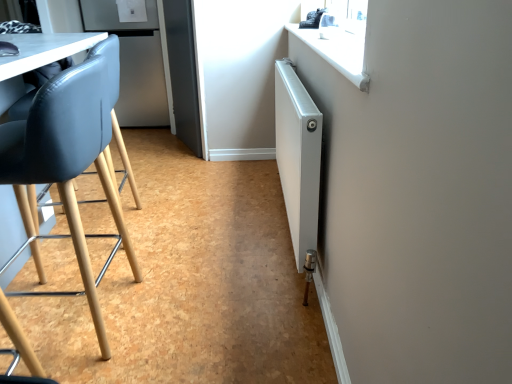
At what (x,y) coordinates should I click in order to perform the action: click on free point below matte black chair at left (from a real-world perspective). Please return your answer as a coordinate pair (x, y). The height and width of the screenshot is (384, 512). Looking at the image, I should click on (81, 316).